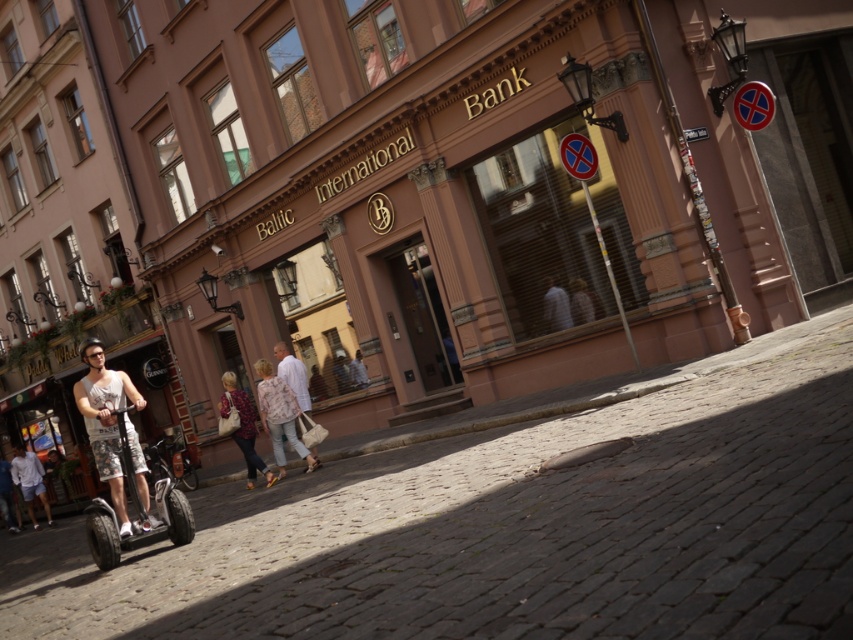
You are a photographer standing in front of the Baltic International Bank. You see the light pink fabric jacket at center and the white cotton shorts at lower left. Which item would you need to adjust your camera angle to capture fully in a single shot if it is wider?

The light pink fabric jacket at center might be wider than white cotton shorts at lower left, so you should adjust your camera angle to ensure the light pink fabric jacket at center is fully captured in the shot.

You are a fashion designer observing the street scene in front of the Baltic International Bank. You notice the light blue denim shorts at lower left and the smooth beige shirt at center. Which clothing item appears larger in size?

The light blue denim shorts at lower left is bigger than the smooth beige shirt at center.

Based on the photo, you are a photographer standing on the street in front of the Baltic International Bank. You see the light pink fabric jacket at center and the white cotton shorts at lower left. Which object is closer to you?

The light pink fabric jacket at center is closer to you because it is in front of the white cotton shorts at lower left.